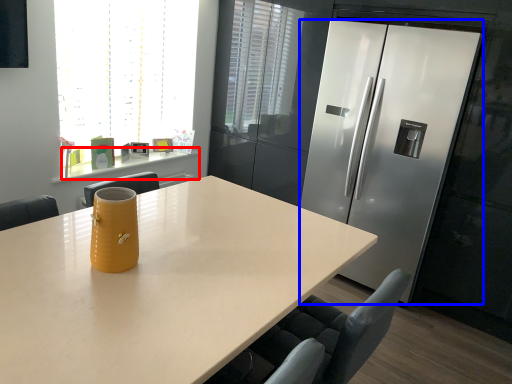
Question: Which object is further to the camera taking this photo, counter (highlighted by a red box) or refrigerator (highlighted by a blue box)?

Choices:
 (A) counter
 (B) refrigerator

Answer: (A)